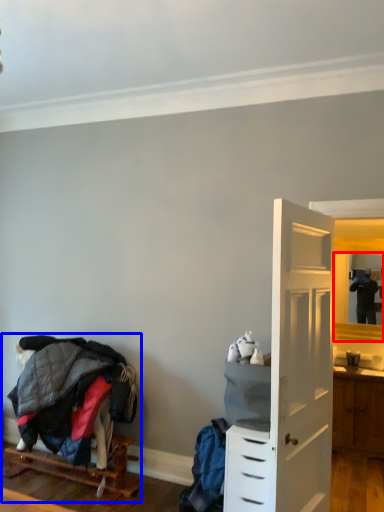
Question: Which point is closer to the camera, mirror (highlighted by a red box) or bunk bed (highlighted by a blue box)?

Choices:
 (A) mirror
 (B) bunk bed

Answer: (B)